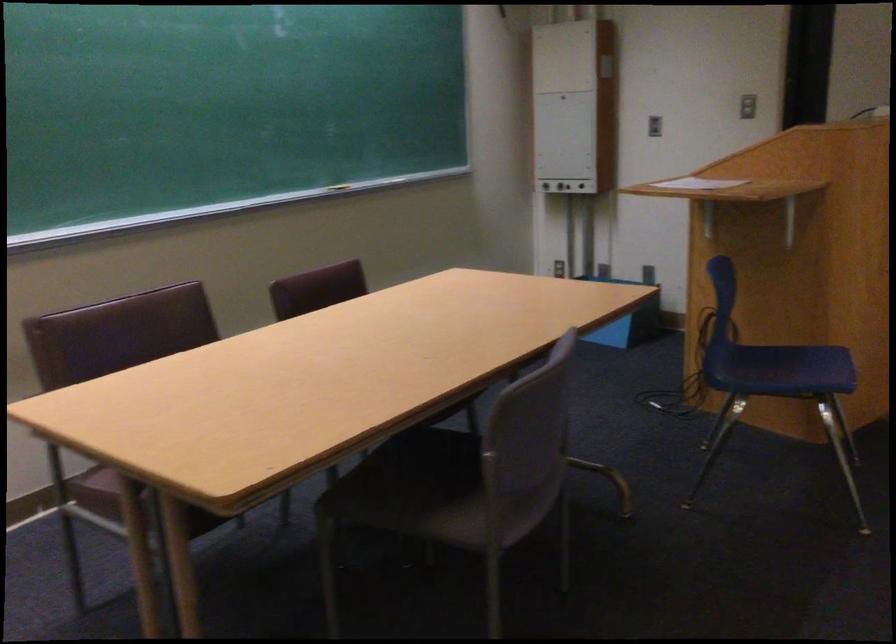
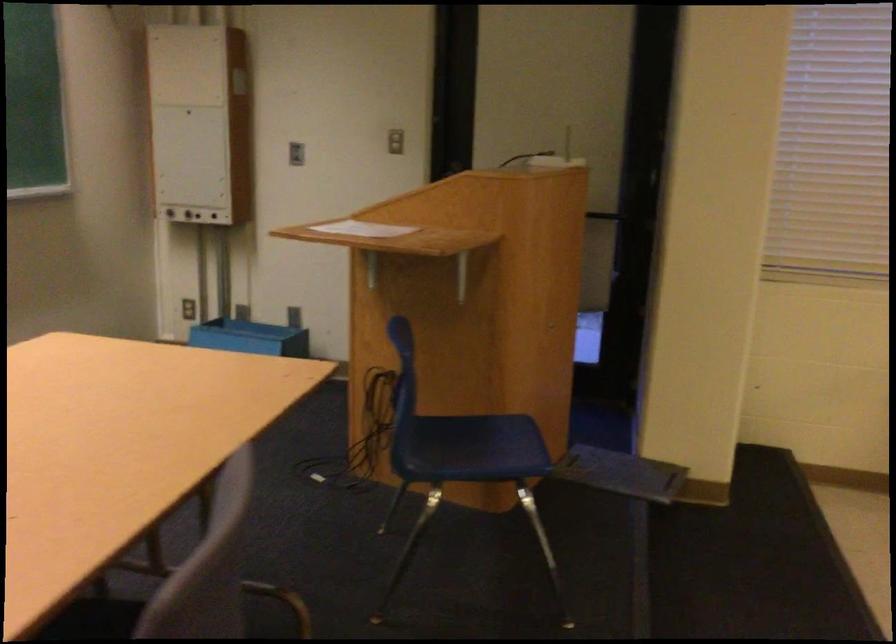
Where in the second image is the point corresponding to (780,366) from the first image?

(466, 442)